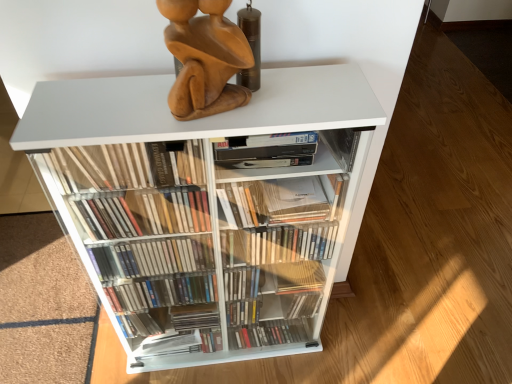
Where is `free space above white plastic bookcase at center (from a real-world perspective)`? This screenshot has width=512, height=384. free space above white plastic bookcase at center (from a real-world perspective) is located at coordinates pyautogui.click(x=181, y=110).